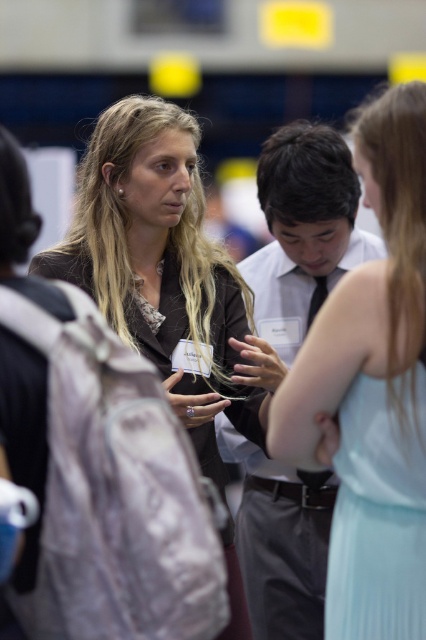
Can you confirm if matte black jacket at center is thinner than white shirt at center?

In fact, matte black jacket at center might be wider than white shirt at center.

Between matte black jacket at center and white shirt at center, which one appears on the right side from the viewer's perspective?

Positioned to the right is white shirt at center.

This screenshot has height=640, width=426. I want to click on matte black jacket at center, so click(x=161, y=266).